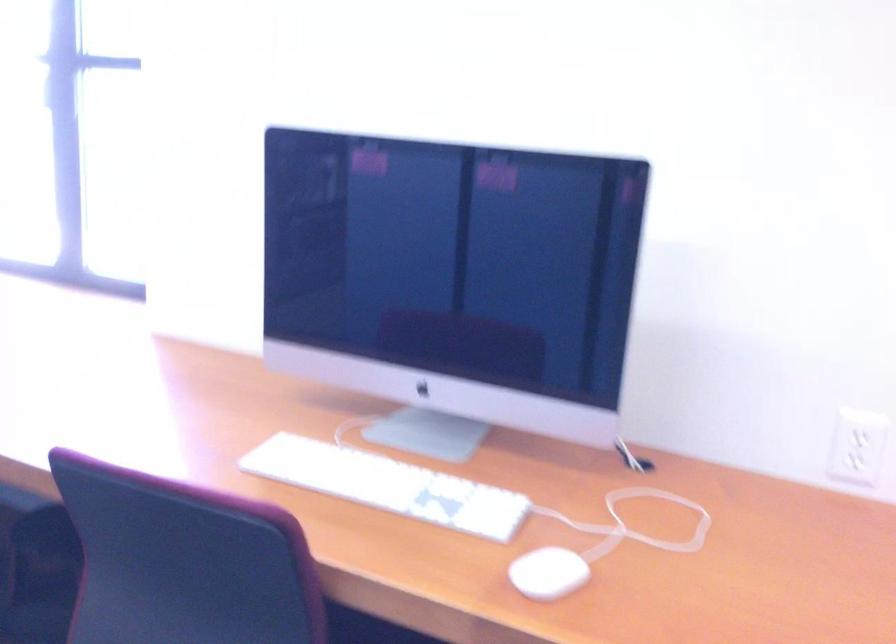
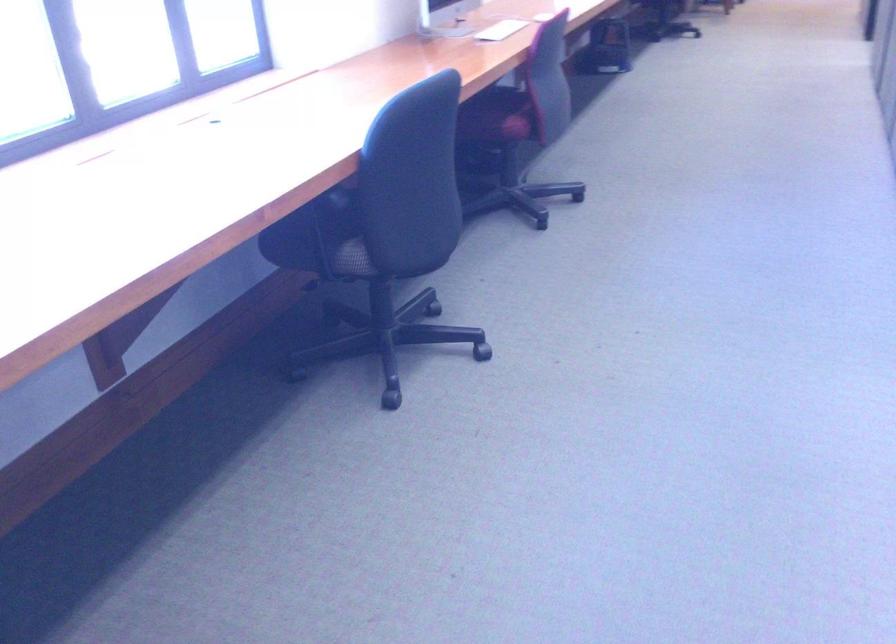
In the second image, find the point that corresponds to the point at 299,473 in the first image.

(501, 30)